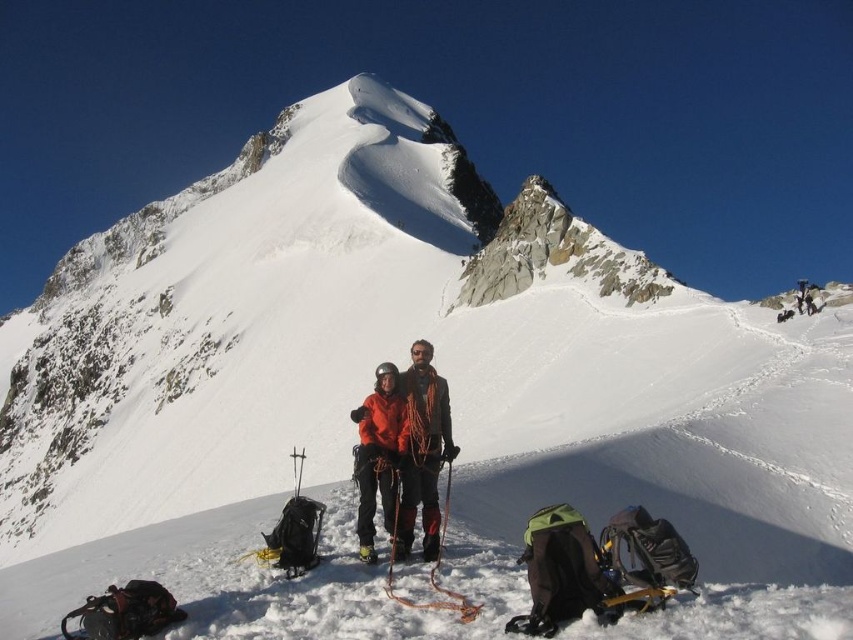
Is point (421, 440) less distant than point (363, 481)?

No, (421, 440) is behind (363, 481).

Can you confirm if orange fabric jacket at center is smaller than orange softshell jacket at center?

Incorrect, orange fabric jacket at center is not smaller in size than orange softshell jacket at center.

Does point (418, 435) come in front of point (361, 506)?

No.

At what (x,y) coordinates should I click in order to perform the action: click on orange fabric jacket at center. Please return your answer as a coordinate pair (x, y). This screenshot has width=853, height=640. Looking at the image, I should click on (422, 451).